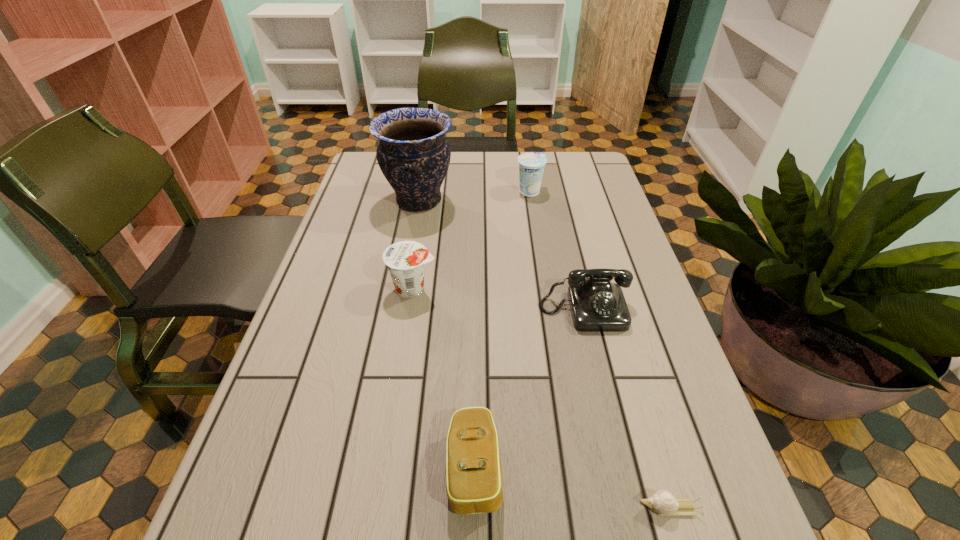
Identify the location of object that is at the far left corner. The height and width of the screenshot is (540, 960). (413, 154).

In the image, there is a desktop. Where is `vacant area at the far edge`? This screenshot has height=540, width=960. vacant area at the far edge is located at coordinates (551, 173).

In the image, there is a desktop. Identify the location of free region at the left edge. The width and height of the screenshot is (960, 540). (309, 327).

This screenshot has height=540, width=960. In the image, there is a desktop. Identify the location of free space at the right edge. coord(606,233).

Locate an element on the screen. The image size is (960, 540). free region at the far right corner of the desktop is located at coordinates (554, 167).

The height and width of the screenshot is (540, 960). I want to click on empty location between the right yogurt and the fifth tallest object, so click(502, 330).

Where is `empty space that is in between the tallest object and the escargot`? Image resolution: width=960 pixels, height=540 pixels. empty space that is in between the tallest object and the escargot is located at coordinates (544, 354).

Image resolution: width=960 pixels, height=540 pixels. I want to click on vacant area that lies between the farther yogurt and the nearer yogurt, so click(x=471, y=240).

You are a GUI agent. You are given a task and a screenshot of the screen. Output one action in this format:
    pyautogui.click(x=<x>, y=<y>)
    Task: Click on the unoccupied position between the farther yogurt and the shortest object
    This screenshot has height=540, width=960.
    Given the screenshot: What is the action you would take?
    pyautogui.click(x=600, y=349)

The image size is (960, 540). Identify the location of empty location between the telephone and the shortest object. (627, 409).